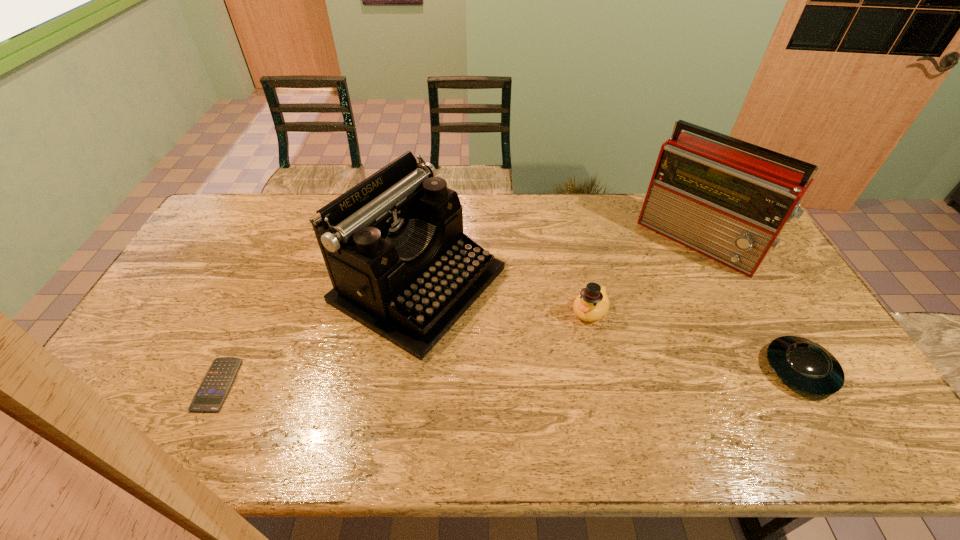
This screenshot has height=540, width=960. In order to click on vacant region located 0.280m on the front-facing side of the radio receiver in this screenshot , I will do `click(629, 316)`.

Identify the location of vacant area situated on the front-facing side of the radio receiver. (651, 292).

This screenshot has width=960, height=540. Identify the location of free space located 0.300m on the front-facing side of the duck. (518, 395).

The image size is (960, 540). In order to click on blank space located on the front-facing side of the duck in this screenshot , I will do `click(509, 407)`.

You are a GUI agent. You are given a task and a screenshot of the screen. Output one action in this format:
    pyautogui.click(x=<x>, y=<y>)
    Task: Click on the free spot located on the front-facing side of the duck
    
    Given the screenshot: What is the action you would take?
    coord(523,390)

At what (x,y) coordinates should I click in order to perform the action: click on blank area located 0.110m on the typing side of the typewriter. Please return your answer as a coordinate pair (x, y). Looking at the image, I should click on (525, 342).

Find the location of a particular element. Image resolution: width=960 pixels, height=540 pixels. free space located on the typing side of the typewriter is located at coordinates (574, 368).

Locate an element on the screen. vacant space situated on the typing side of the typewriter is located at coordinates (550, 356).

You are a GUI agent. You are given a task and a screenshot of the screen. Output one action in this format:
    pyautogui.click(x=<x>, y=<y>)
    Task: Click on the radio receiver at the far edge
    
    Given the screenshot: What is the action you would take?
    pyautogui.click(x=730, y=206)

Where is `typewriter that is positioned at the far edge`? This screenshot has width=960, height=540. typewriter that is positioned at the far edge is located at coordinates (393, 245).